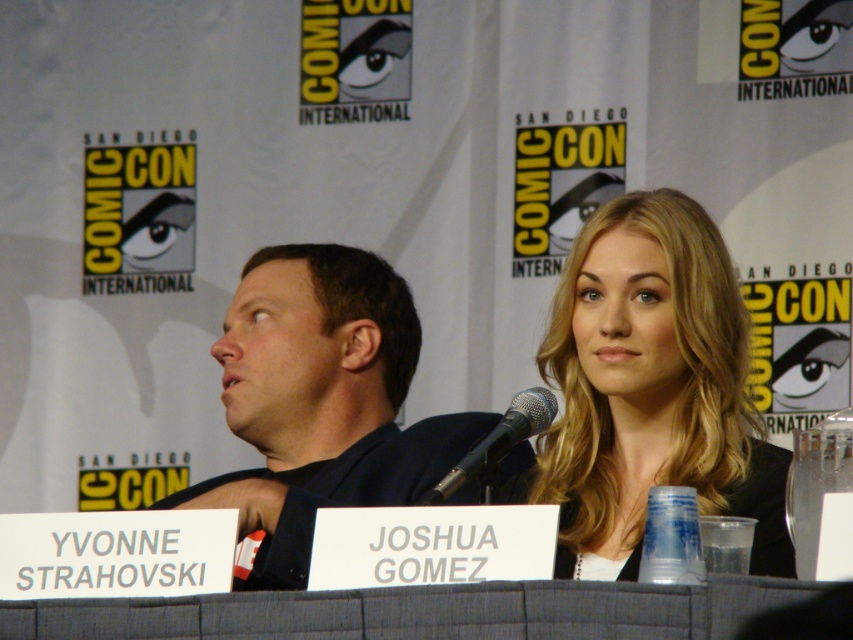
Question: Can you confirm if dark blue shirt at left is wider than black metallic microphone at center?

Choices:
 (A) no
 (B) yes

Answer: (B)

Question: Where is blonde hair at upper right located in relation to gray fabric table at center in the image?

Choices:
 (A) left
 (B) right

Answer: (B)

Question: Which object is the closest to the gray fabric table at center?

Choices:
 (A) black metallic microphone at center
 (B) blonde hair at upper right
 (C) dark blue shirt at left

Answer: (A)

Question: Where is dark blue shirt at left located in relation to black metallic microphone at center in the image?

Choices:
 (A) right
 (B) left

Answer: (B)

Question: Among these objects, which one is farthest from the camera?

Choices:
 (A) blonde hair at upper right
 (B) gray fabric table at center

Answer: (A)

Question: Which object is the farthest from the blonde hair at upper right?

Choices:
 (A) black metallic microphone at center
 (B) gray fabric table at center

Answer: (B)